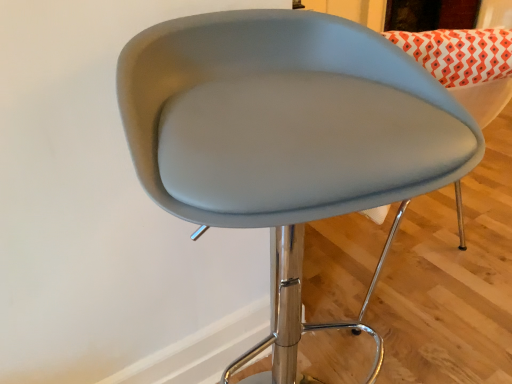
What do you see at coordinates (285, 135) in the screenshot?
I see `matte gray stool at center` at bounding box center [285, 135].

This screenshot has width=512, height=384. Identify the location of matte gray stool at center. (285, 135).

This screenshot has height=384, width=512. In order to click on matte gray stool at center in this screenshot , I will do `click(285, 135)`.